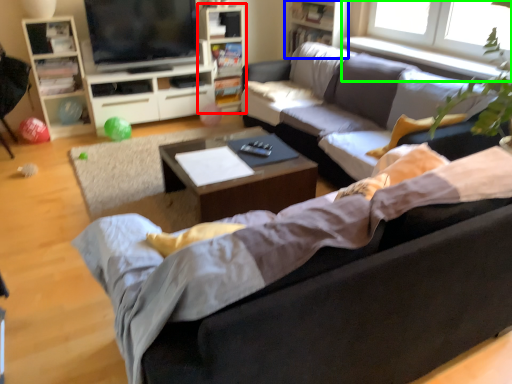
Question: Based on their relative distances, which object is farther from bookshelf (highlighted by a red box)? Choose from bookshelf (highlighted by a blue box) and window (highlighted by a green box).

Choices:
 (A) bookshelf
 (B) window

Answer: (B)